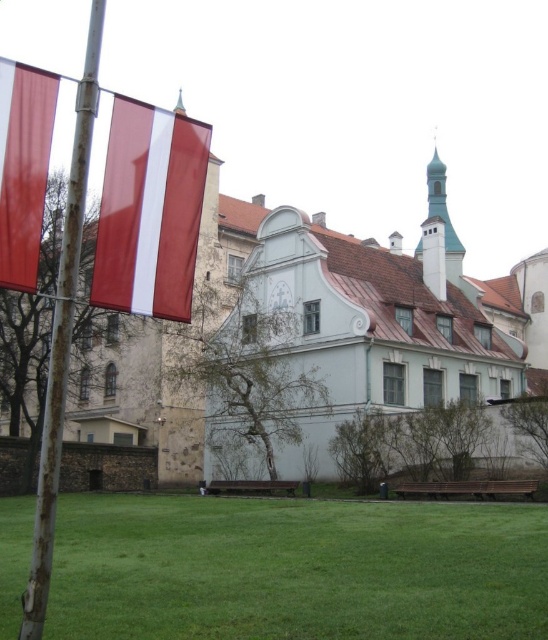
Based on the photo, does red glossy flag at upper left have a lesser width compared to matte red flag at left?

No.

Is point (113, 106) positioned behind point (3, 196)?

Yes, it is behind point (3, 196).

At what (x,y) coordinates should I click in order to perform the action: click on red glossy flag at upper left. Please return your answer as a coordinate pair (x, y). Looking at the image, I should click on (150, 211).

From the picture: Does green grass at lower center have a greater height compared to rusty metal flag pole at left?

Incorrect, green grass at lower center's height is not larger of rusty metal flag pole at left's.

Consider the image. Does green grass at lower center have a lesser width compared to rusty metal flag pole at left?

Yes.

You are a GUI agent. You are given a task and a screenshot of the screen. Output one action in this format:
    pyautogui.click(x=<x>, y=<y>)
    Task: Click on the green grass at lower center
    The height and width of the screenshot is (640, 548).
    Given the screenshot: What is the action you would take?
    pyautogui.click(x=296, y=570)

Looking at this image, which of these two, green grass at lower center or red glossy flag at upper left, stands taller?

With more height is red glossy flag at upper left.

Can you confirm if green grass at lower center is taller than red glossy flag at upper left?

No.

Is point (101, 502) less distant than point (101, 241)?

No, it is not.

This screenshot has height=640, width=548. Identify the location of green grass at lower center. (296, 570).